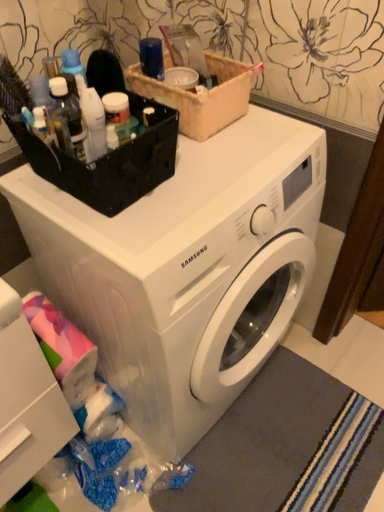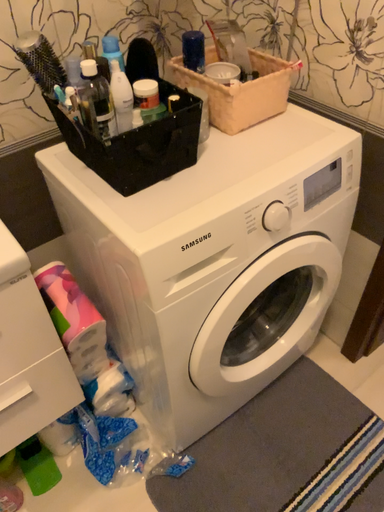
Question: Which way did the camera rotate in the video?

Choices:
 (A) rotated right
 (B) rotated left

Answer: (B)